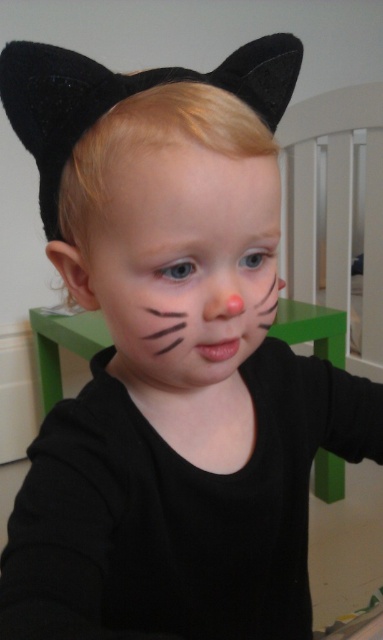
You are a photographer adjusting your camera settings to capture the child in the scene. You notice the matte black face at center and the smooth skin at center. Which surface will reflect less light and require a different exposure setting?

The matte black face at center reflects less light than the smooth skin at center because matte surfaces scatter light in multiple directions, reducing direct reflection. Since it is closer to the viewer, the photographer should adjust the exposure to account for its lower reflectivity.

Based on the scene description, which object is positioned lower on the child? The matte black face at center or the smooth skin at center?

The matte black face at center is positioned lower than the smooth skin at center.